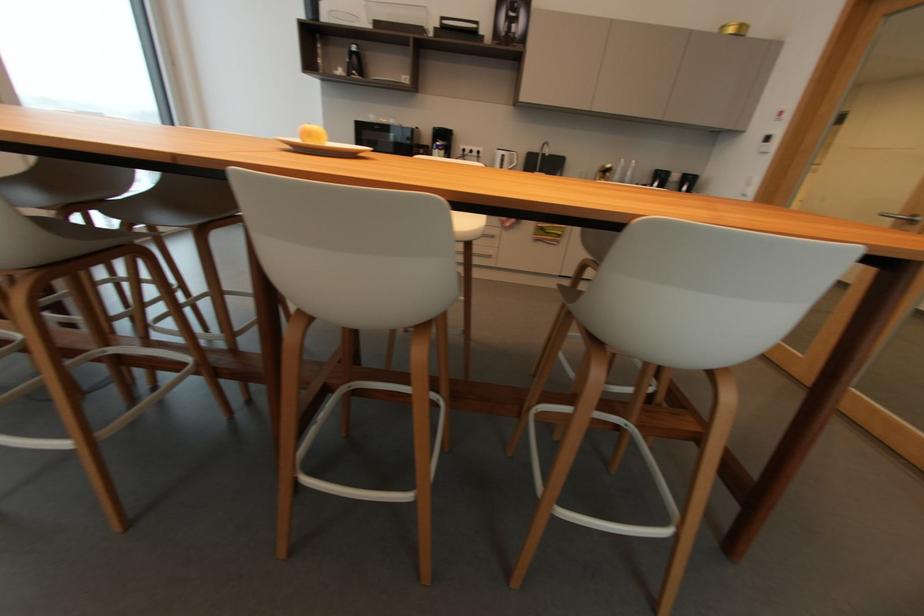
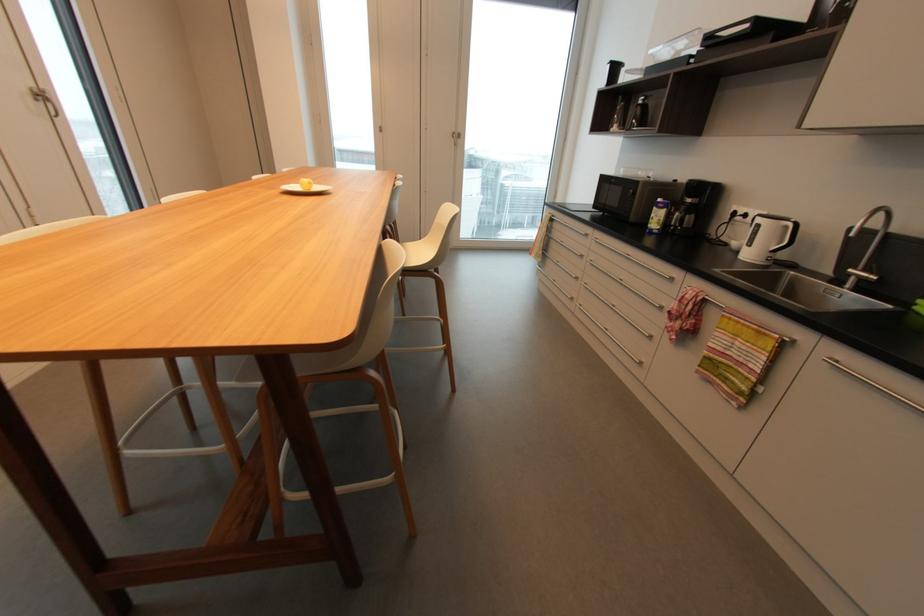
Find the pixel in the second image that matches the point at 516,156 in the first image.

(789, 227)